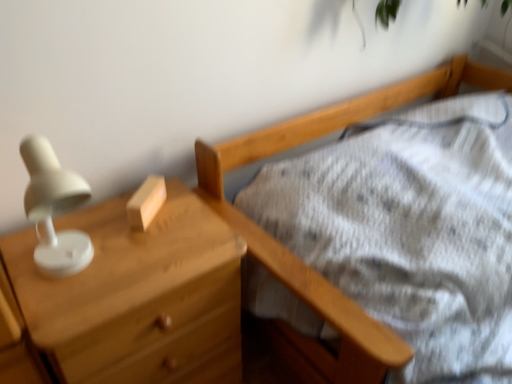
Identify the location of free space to the right of wooden block at center. (194, 222).